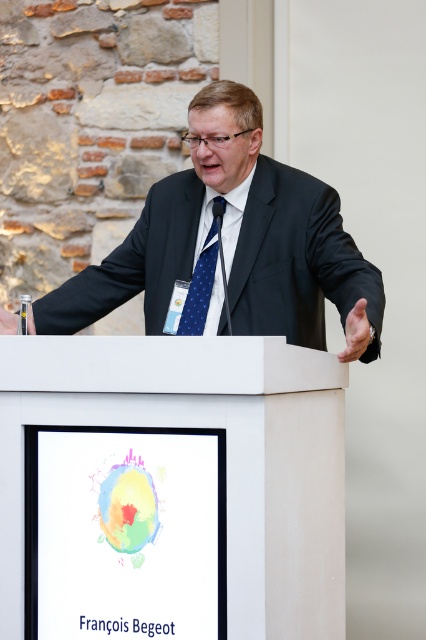
You are a photographer positioned behind the speaker. You want to take a photo that includes both the white matte podium at center and the blue dotted fabric tie at center. Which object should you pan your camera to the right to include first?

You should pan your camera to the right to include the white matte podium at center first because it is positioned to the right of the blue dotted fabric tie at center.

You are standing in the room where the presentation is taking place. You want to approach the white matte podium at center to ask a question. Which direction should you walk to reach it?

Since the white matte podium at center is located at point (170, 488), you should walk towards the center of the room to reach it.